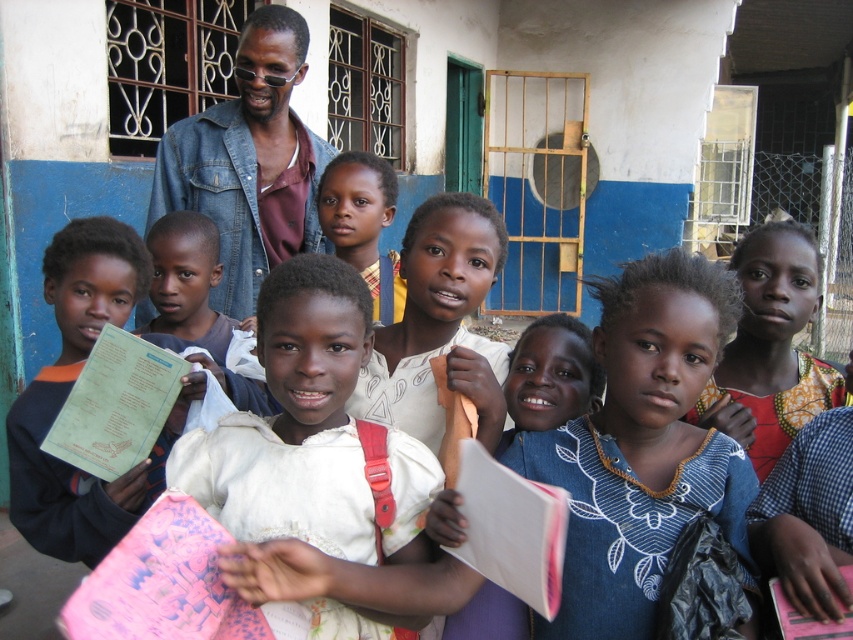
Is white cotton dress at center above smooth skin face at center?

Actually, white cotton dress at center is below smooth skin face at center.

Does point (196, 493) come in front of point (345, 224)?

Yes, point (196, 493) is closer to viewer.

Image resolution: width=853 pixels, height=640 pixels. In order to click on white cotton dress at center in this screenshot , I will do `click(311, 433)`.

Between white cotton dress at center and printed fabric dress at center, which one is positioned lower?

Positioned lower is white cotton dress at center.

Does white cotton dress at center appear on the left side of printed fabric dress at center?

Indeed, white cotton dress at center is positioned on the left side of printed fabric dress at center.

Is point (367, 525) more distant than point (766, 282)?

No, (367, 525) is closer to viewer.

Find the location of a particular element. The width and height of the screenshot is (853, 640). white cotton dress at center is located at coordinates (311, 433).

Looking at this image, measure the distance between matte green book at center and printed fabric dress at center.

matte green book at center and printed fabric dress at center are 1.46 meters apart from each other.

At what (x,y) coordinates should I click in order to perform the action: click on matte green book at center. Please return your answer as a coordinate pair (x, y). Looking at the image, I should click on (68, 394).

In order to click on matte green book at center in this screenshot , I will do `click(68, 394)`.